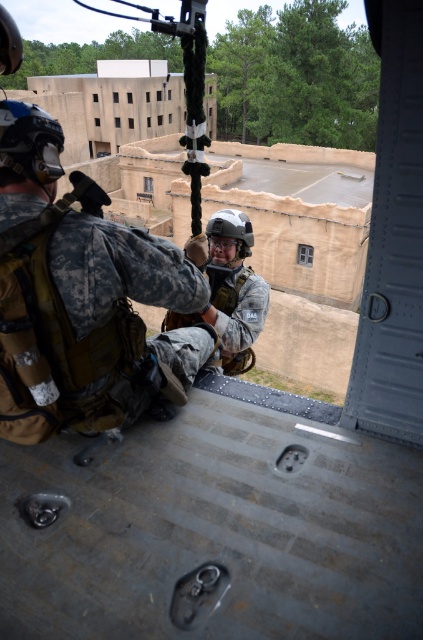
Can you confirm if camouflage fabric uniform at left is positioned to the left of camouflage fabric helmet at center?

Correct, you'll find camouflage fabric uniform at left to the left of camouflage fabric helmet at center.

Between camouflage fabric uniform at left and camouflage fabric helmet at center, which one appears on the right side from the viewer's perspective?

camouflage fabric helmet at center is more to the right.

At what (x,y) coordinates should I click in order to perform the action: click on camouflage fabric uniform at left. Please return your answer as a coordinate pair (x, y). Looking at the image, I should click on (79, 296).

You are a GUI agent. You are given a task and a screenshot of the screen. Output one action in this format:
    pyautogui.click(x=<x>, y=<y>)
    Task: Click on the camouflage fabric uniform at left
    The height and width of the screenshot is (640, 423).
    Given the screenshot: What is the action you would take?
    pyautogui.click(x=79, y=296)